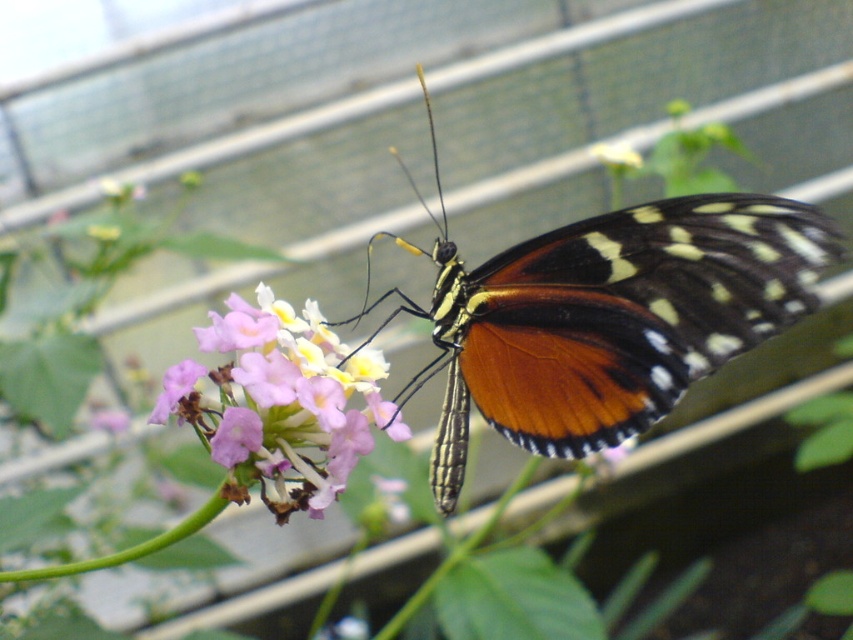
You are a gardener trying to identify the tallest object between the orange iridescent wings at center and the pink matte flower at center in the greenhouse. Which one is taller?

The orange iridescent wings at center is taller than the pink matte flower at center.

You are an entomologist observing a butterfly in a greenhouse. You notice the orange iridescent wings at center and the pink matte flower at center. Which object is positioned to the right of the other?

The orange iridescent wings at center is to the right of the pink matte flower at center.

You are a gardener who wants to water the pink matte flower at center without getting the orange iridescent wings at center wet. Since the butterfly is resting, you need to avoid disturbing it. Can you water the flower directly from above? Explain why or why not based on their positions.

The orange iridescent wings at center are in front of the pink matte flower at center. If you water from above, the water would hit the wings first, potentially disturbing the butterfly. To avoid this, you should water from the side or angle the hose to reach behind the wings.